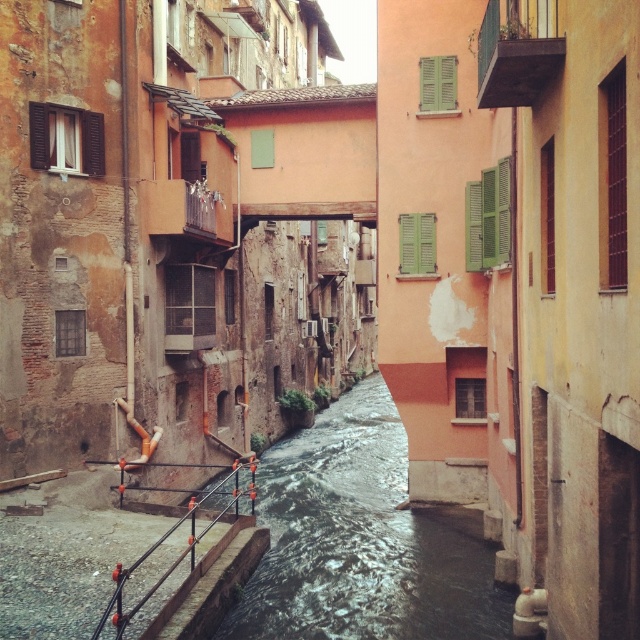
Looking at this image, who is more forward, (484, 224) or (445, 96)?

Point (484, 224)

Which of these two, green matte shutters at upper center or green wooden shutters at upper center, stands taller?

green matte shutters at upper center is taller.

Does point (477, 252) lie in front of point (419, 84)?

Yes, point (477, 252) is closer to viewer.

Locate an element on the screen. green matte shutters at upper center is located at coordinates (488, 218).

Is brown wooden shutter at right thinner than green wooden shutters at upper center?

Yes, brown wooden shutter at right is thinner than green wooden shutters at upper center.

Is point (616, 92) positioned after point (448, 106)?

No.

Image resolution: width=640 pixels, height=640 pixels. Find the location of `brown wooden shutter at right`. brown wooden shutter at right is located at coordinates point(612,179).

Is black metal railing at lower center to the left of green wooden shutters at upper center from the viewer's perspective?

Indeed, black metal railing at lower center is positioned on the left side of green wooden shutters at upper center.

Who is more forward, (192, 544) or (432, 67)?

Point (192, 544) is in front.

Does point (236, 476) lie behind point (428, 92)?

That is True.

In order to click on black metal railing at lower center in this screenshot , I will do `click(184, 548)`.